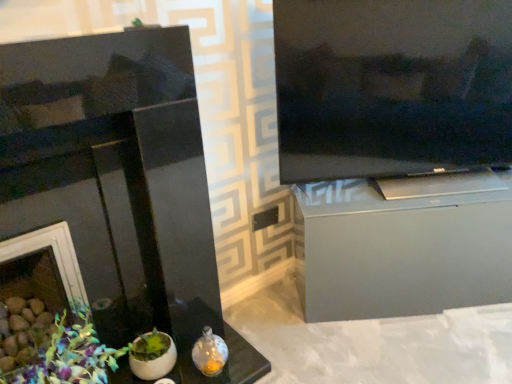
The height and width of the screenshot is (384, 512). Identify the location of vacant area that is in front of satin silver cabinet at right. coord(435,342).